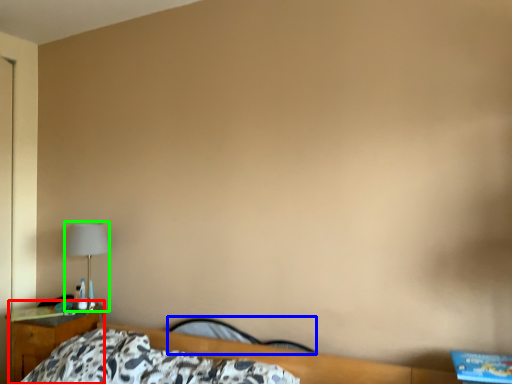
Question: Considering the real-world distances, which object is farthest from nightstand (highlighted by a red box)? chair (highlighted by a blue box) or lamp (highlighted by a green box)?

Choices:
 (A) chair
 (B) lamp

Answer: (A)